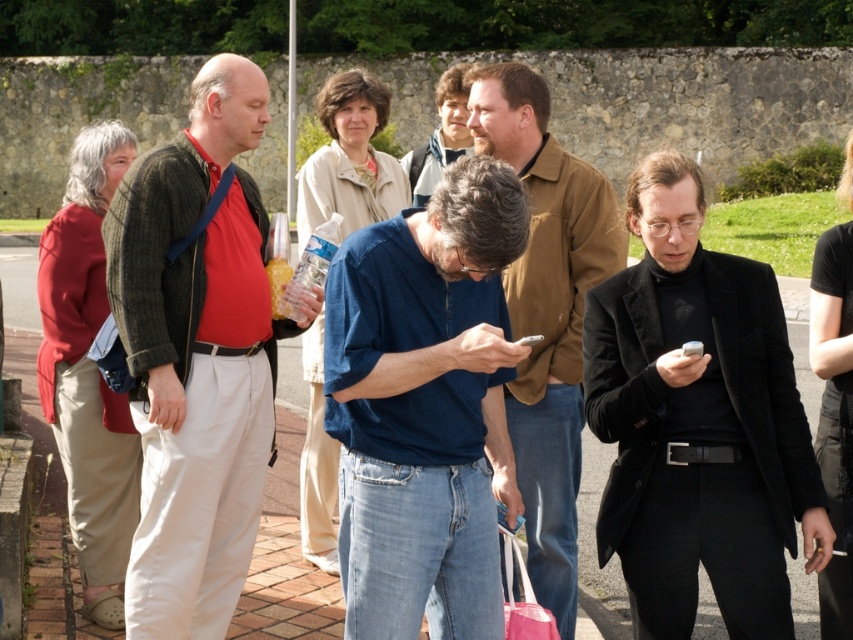
Is matte red shirt at left in front of denim jeans at center?

No, it is behind denim jeans at center.

Is matte red shirt at left thinner than denim jeans at center?

In fact, matte red shirt at left might be wider than denim jeans at center.

Between point (254, 493) and point (556, 275), which one is positioned in front?

Positioned in front is point (254, 493).

Where is `matte red shirt at left`? Image resolution: width=853 pixels, height=640 pixels. matte red shirt at left is located at coordinates (196, 356).

Is point (167, 616) positioned before point (525, 636)?

No, it is not.

Is matte red shirt at left in front of pink fabric shopping bag at lower center?

No, matte red shirt at left is behind pink fabric shopping bag at lower center.

Does point (126, 593) come closer to viewer compared to point (531, 602)?

No, (126, 593) is behind (531, 602).

Find the location of `matte red shirt at left`. matte red shirt at left is located at coordinates (196, 356).

From the picture: Does black wool coat at center have a lesser height compared to denim jeans at center?

Yes, black wool coat at center is shorter than denim jeans at center.

Does point (743, 429) come in front of point (560, 538)?

Yes, it is.

Identify the location of black wool coat at center. (698, 422).